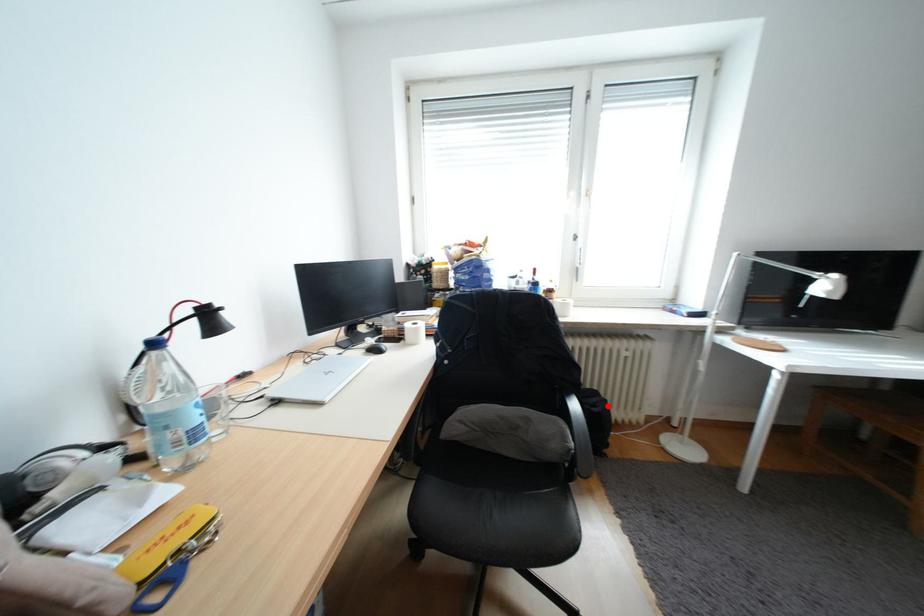
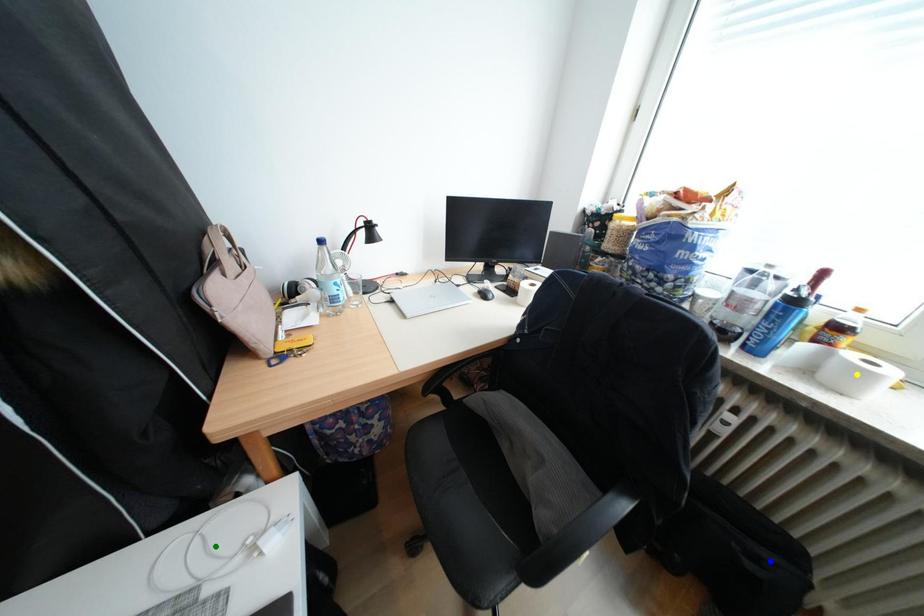
Question: I am providing you with two images of the same scene from different viewpoints. A red point is marked on the first image. You are given multiple points on the second image. Which point in image 2 is actually the same real-world point as the red point in image 1?

Choices:
 (A) green point
 (B) blue point
 (C) yellow point

Answer: (B)